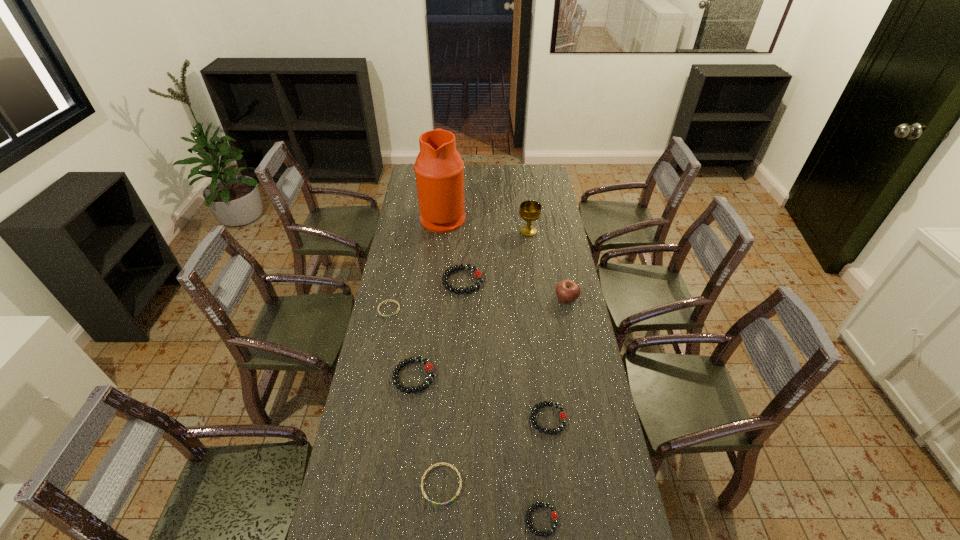
I want to click on free spot located on the front of the third farthest bracelet, so click(408, 422).

Where is `vacant position located on the left of the fourth shortest bracelet`? The height and width of the screenshot is (540, 960). vacant position located on the left of the fourth shortest bracelet is located at coordinates (512, 419).

Image resolution: width=960 pixels, height=540 pixels. Find the location of `free space located on the back of the smallest black bracelet`. free space located on the back of the smallest black bracelet is located at coordinates 537,471.

The image size is (960, 540). What are the coordinates of `blank space located 0.370m on the surface of the farther blue bracelet showing star-shaped elements` in the screenshot? It's located at (371, 399).

This screenshot has height=540, width=960. Identify the location of water jug at the left edge. (439, 169).

At what (x,y) coordinates should I click in order to perform the action: click on chalice present at the right edge. Please return your answer as a coordinate pair (x, y). The image size is (960, 540). Looking at the image, I should click on (530, 211).

Locate an element on the screen. Image resolution: width=960 pixels, height=540 pixels. apple that is at the right edge is located at coordinates (567, 291).

This screenshot has width=960, height=540. What are the coordinates of `bracelet that is positioned at the right edge` in the screenshot? It's located at (563, 416).

I want to click on vacant point at the far edge, so click(x=512, y=166).

Identify the location of free location at the left edge of the desktop. The height and width of the screenshot is (540, 960). (396, 324).